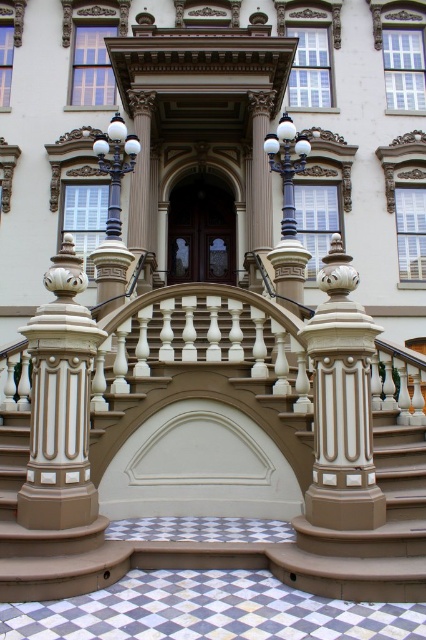
You are standing at the entrance of a grand building and want to take a photo of the matte beige staircase at center. If your camera can focus on objects up to 30 feet away, will it be able to capture a clear image of the staircase?

The matte beige staircase at center and camera are 30.69 feet apart. Since the camera can focus up to 30 feet, it cannot capture a clear image as the distance exceeds its maximum focus range.

You are a visitor approaching the entrance of the grand building. You notice the matte beige staircase at center and the beige glossy column at center. Which object is closer to you as you approach the entrance?

The matte beige staircase at center is closer to you because the beige glossy column at center is positioned behind it.

You are standing at the entrance of the grand building and want to locate a specific point marked as point (247, 417). According to the scene description, where exactly is this point located?

The point (247, 417) is located on the matte beige staircase at center.